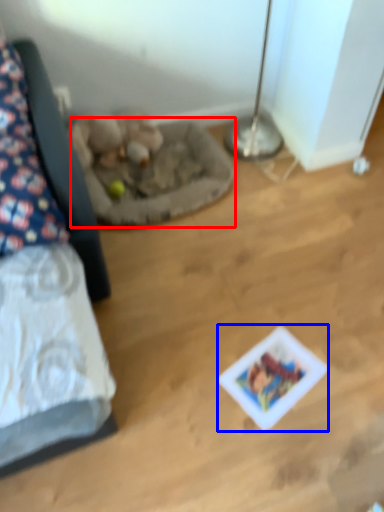
Question: Which object appears closest to the camera in this image, cat bed (highlighted by a red box) or card game (highlighted by a blue box)?

Choices:
 (A) cat bed
 (B) card game

Answer: (B)